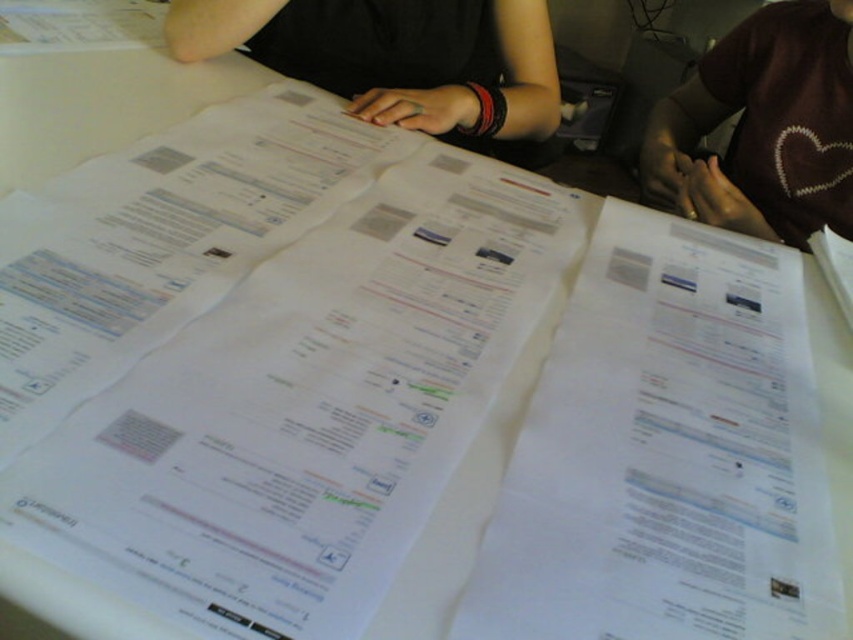
You are standing at the point marked by the coordinates point (x=670, y=451). You need to reach the door located 22.88 inches away from you. Is the distance sufficient to walk to the door without any obstacles?

The distance between you and the door is 22.88 inches, which is approximately 1.9 feet. This distance is short enough to walk to the door without any obstacles, assuming there are no objects blocking the path. However, the scene description mentions overlapping papers on the table but does not specify if they obstruct the path. Since the question focuses on distance, the answer is yes, the distance is sufficient.

You are standing in front of the table with papers. You need to reach a specific point on the table marked at coordinates point (755, 296). If your hand is 12 inches long, can you comfortably reach that point without moving your body?

The distance between point (755, 296) and the viewer is 32.82 inches. Since your hand is only 12 inches long, you cannot comfortably reach that point without moving your body.